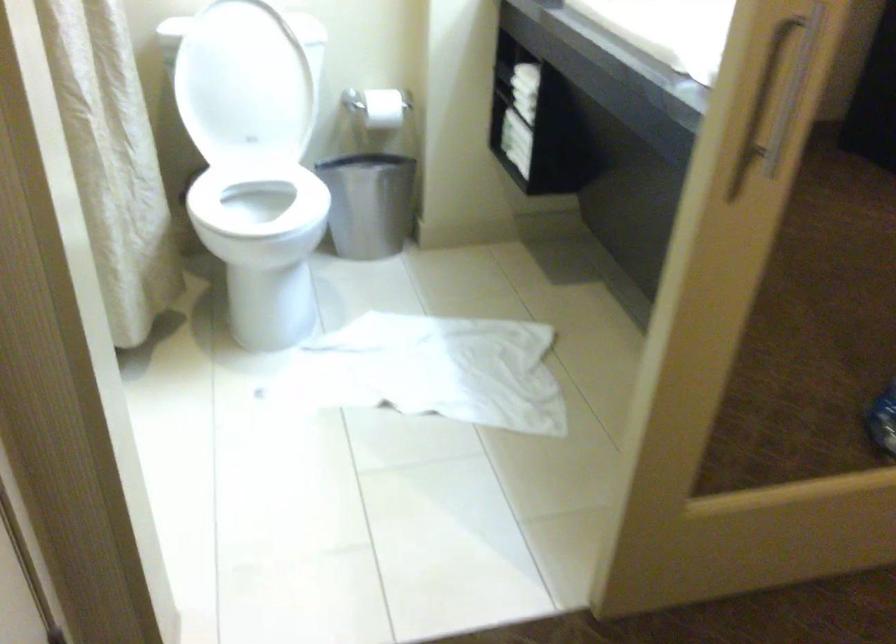
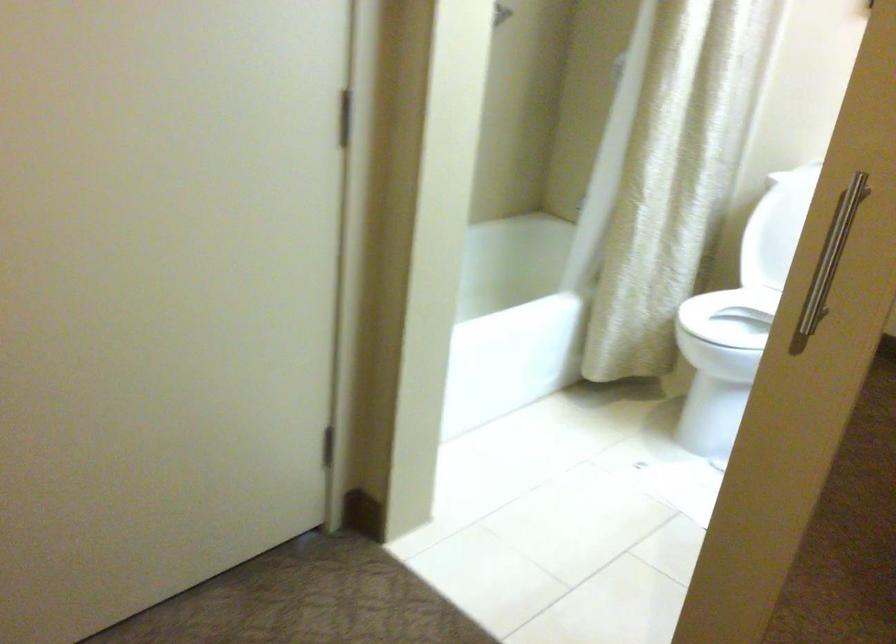
Question: I am providing you with two images of the same scene from different viewpoints. Please identify which objects are invisible in image2.

Choices:
 (A) white toilet lid
 (B) metal door handle
 (C) black closet knob
 (D) white toilet seat

Answer: (A)